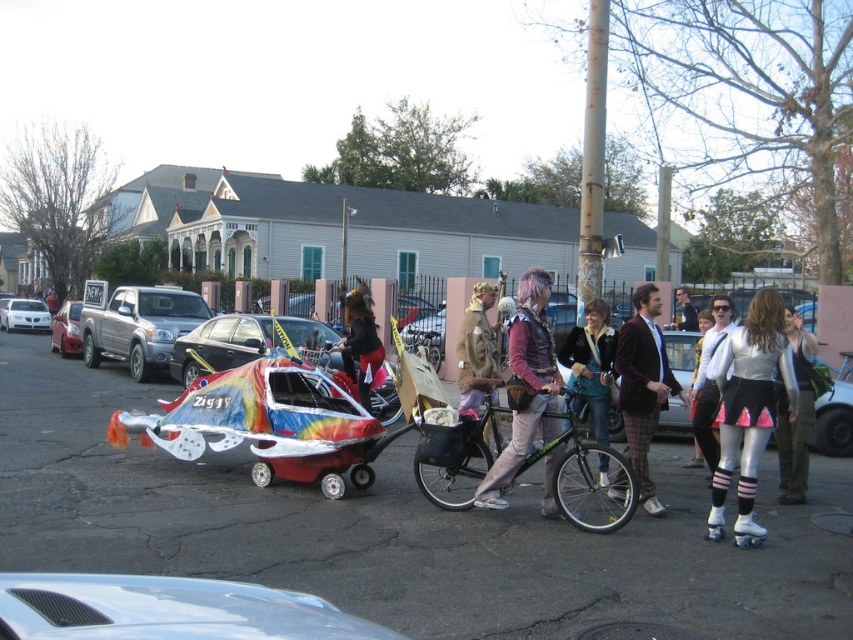
Does point (546, 509) lie in front of point (68, 332)?

Yes.

Between point (534, 433) and point (64, 307), which one is positioned in front?

Positioned in front is point (534, 433).

Where is `shiny purple jacket at center`? This screenshot has width=853, height=640. shiny purple jacket at center is located at coordinates click(526, 385).

Does metallic silver car at center come behind white matte car at left?

No, it is in front of white matte car at left.

Between metallic silver car at center and white matte car at left, which one has less height?

Standing shorter between the two is white matte car at left.

Is point (54, 481) closer to viewer compared to point (41, 320)?

Yes, point (54, 481) is closer to viewer.

In order to click on metallic silver car at center in this screenshot , I will do 395,531.

Who is more forward, [239,605] or [547,508]?

Point [239,605] is more forward.

Between shiny silver car at center and shiny purple jacket at center, which one is positioned lower?

Positioned lower is shiny purple jacket at center.

Is point (171, 586) positioned in front of point (524, 323)?

Yes, point (171, 586) is in front of point (524, 323).

The image size is (853, 640). Find the location of `shiny silver car at center`. shiny silver car at center is located at coordinates (167, 609).